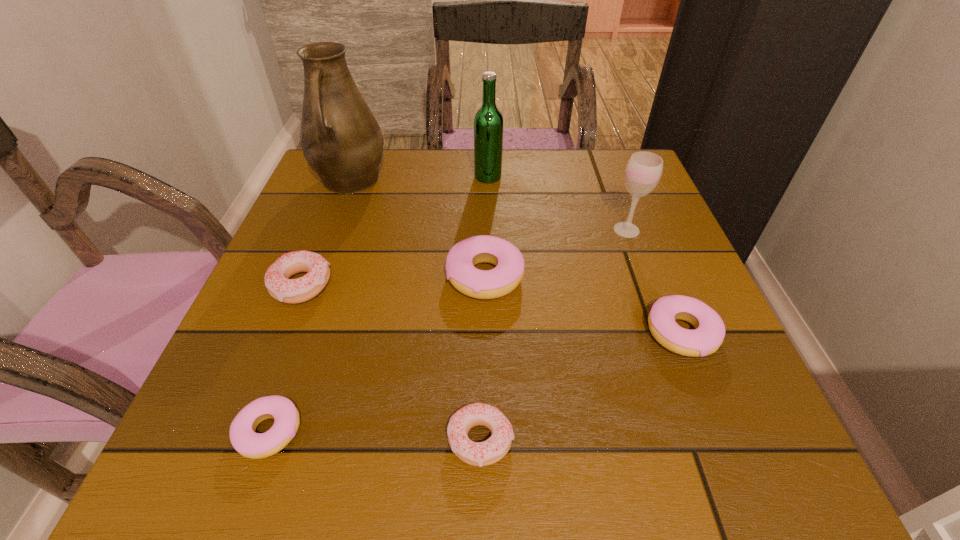
Identify the location of vacant region between the rightmost doughnut and the wineglass. This screenshot has width=960, height=540. (654, 281).

Identify the location of free space between the biggest pink doughnut and the smallest pink doughnut. The image size is (960, 540). (377, 354).

Locate an element on the screen. The height and width of the screenshot is (540, 960). blank region between the second nearest pink doughnut and the smaller white doughnut is located at coordinates (581, 387).

At what (x,y) coordinates should I click in order to perform the action: click on free area in between the sixth shortest object and the pitcher. Please return your answer as a coordinate pair (x, y). Looking at the image, I should click on (489, 206).

The image size is (960, 540). Identify the location of free point between the wineglass and the right white doughnut. (554, 335).

Find the location of `free space between the second tallest object and the tallest object`. free space between the second tallest object and the tallest object is located at coordinates [420, 179].

Locate which object is the seventh closest to the green beer bottle. Please provide its 2D coordinates. Your answer should be formatted as a tuple, i.e. [(x, y)], where the tuple contains the x and y coordinates of a point satisfying the conditions above.

[(245, 440)]

What are the coordinates of `the second closest object to the green beer bottle` in the screenshot? It's located at (482, 284).

The width and height of the screenshot is (960, 540). I want to click on doughnut object that ranks as the closest to the bigger white doughnut, so click(x=245, y=440).

At what (x,y) coordinates should I click in order to perform the action: click on doughnut identified as the closest to the tallest object. Please return your answer as a coordinate pair (x, y). This screenshot has height=540, width=960. Looking at the image, I should click on (292, 291).